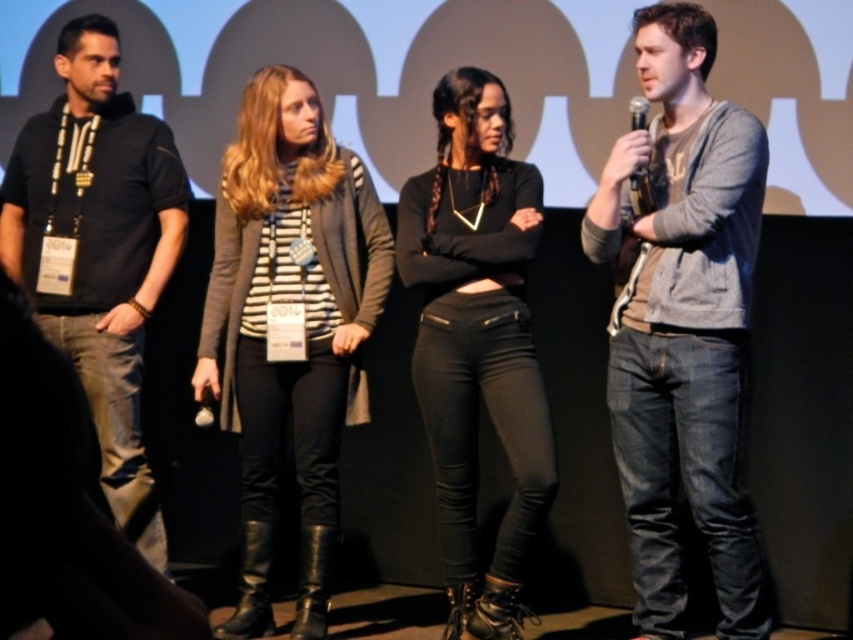
You are standing in the audience and want to point out two specific points on the stage. The first point is at coordinates point (650, 500) and the second is at point (508, 250). Which of these two points is closer to you?

Point (650, 500) is closer to the viewer than point (508, 250).

You are an event organizer checking the stage setup. You notice the gray cotton sweater at right and the black leather pants at center. Which clothing item is positioned higher on the stage?

The gray cotton sweater at right is above the black leather pants at center, so the gray cotton sweater at right is positioned higher on the stage.

From the picture: You are a photographer positioned at the back of the stage. You need to capture a clear photo of both the gray cotton sweater at right and the black cotton polo shirt at left. Can you see both items fully without any obstruction?

The gray cotton sweater at right is in front of the black cotton polo shirt at left, so the gray cotton sweater at right may block part of the black cotton polo shirt at left in your photo.